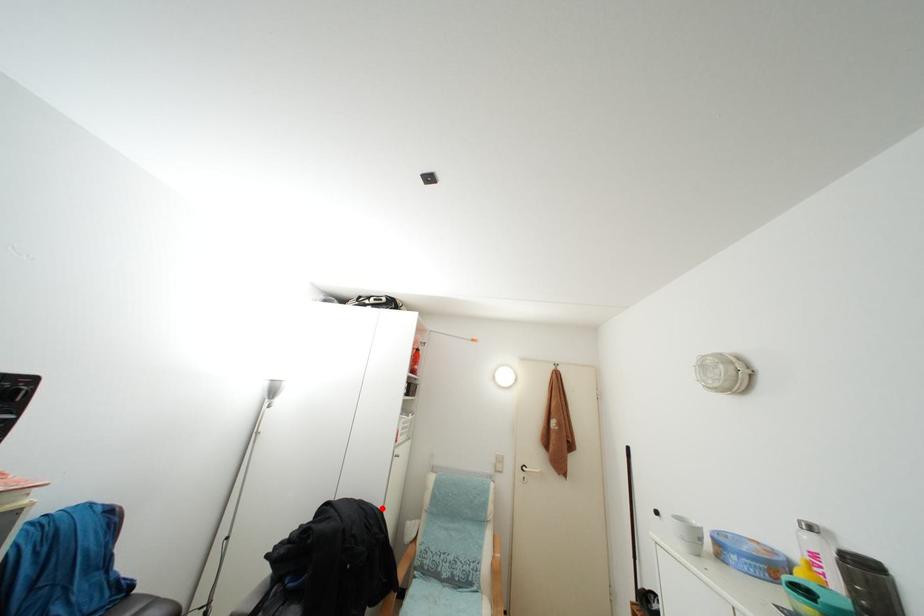
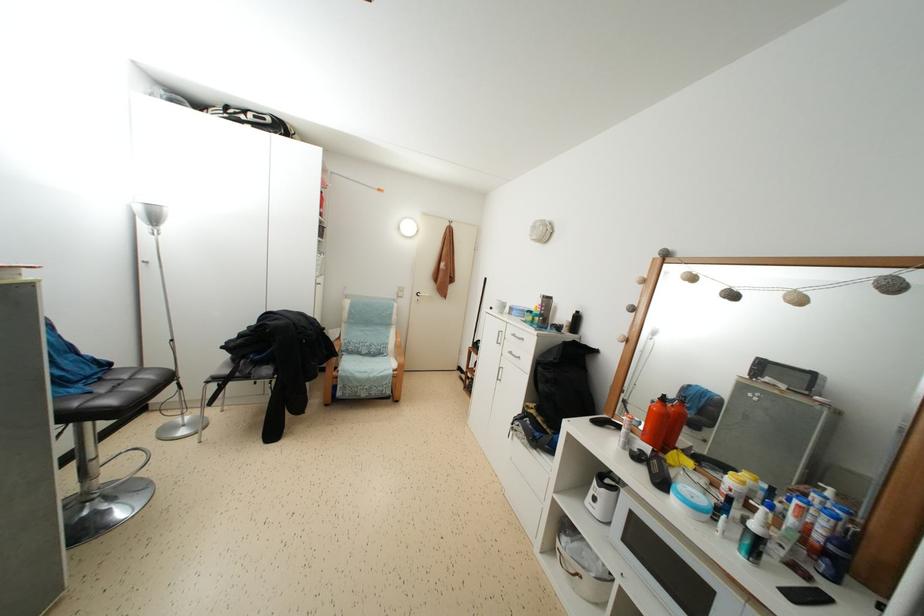
Find the pixel in the second image that matches the highlighted location in the first image.

(313, 320)